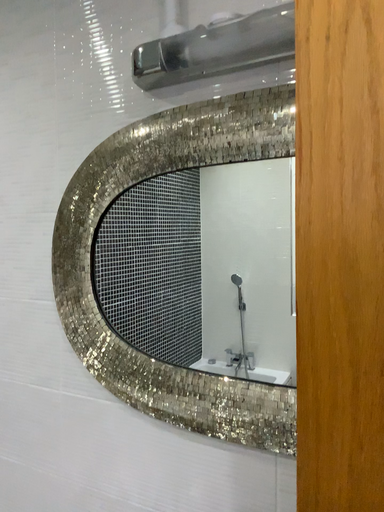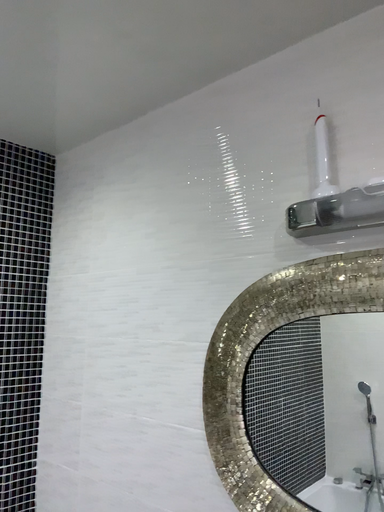
Question: Which way did the camera rotate in the video?

Choices:
 (A) rotated upward
 (B) rotated downward

Answer: (A)